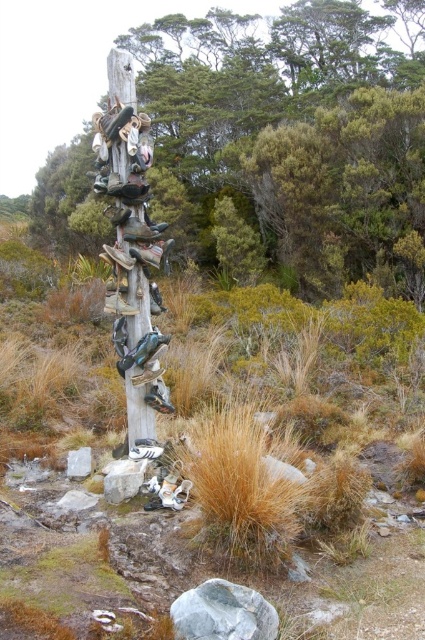
You are a hiker who just arrived at the wooden post with shoes. You need to hang your new pair of shoes on the post but there is only space between the shiny black shoe at center and the matte black shoe at center. Is there enough space for your pair of shoes which are 2 feet long?

The shiny black shoe at center and the matte black shoe at center are 4.05 feet apart from each other. Since your shoes are 2 feet long, there is enough space between them to hang your pair of shoes.

You are standing in front of the wooden post with shoes and want to determine the relative positions of two points marked on the post. Which point, point (334,52) or point (125,154), is closer to you?

Point (334,52) is closer to you because it is further to the viewer than point (125,154).

In the scene shown: You are a hiker who just arrived at the wooden post in the middle of the rugged landscape. You notice two items at the center of the post. Which one is bigger in size between the shiny metallic shoes at center and the white marble stone at center?

The shiny metallic shoes at center are larger in size than the white marble stone at center according to the description.